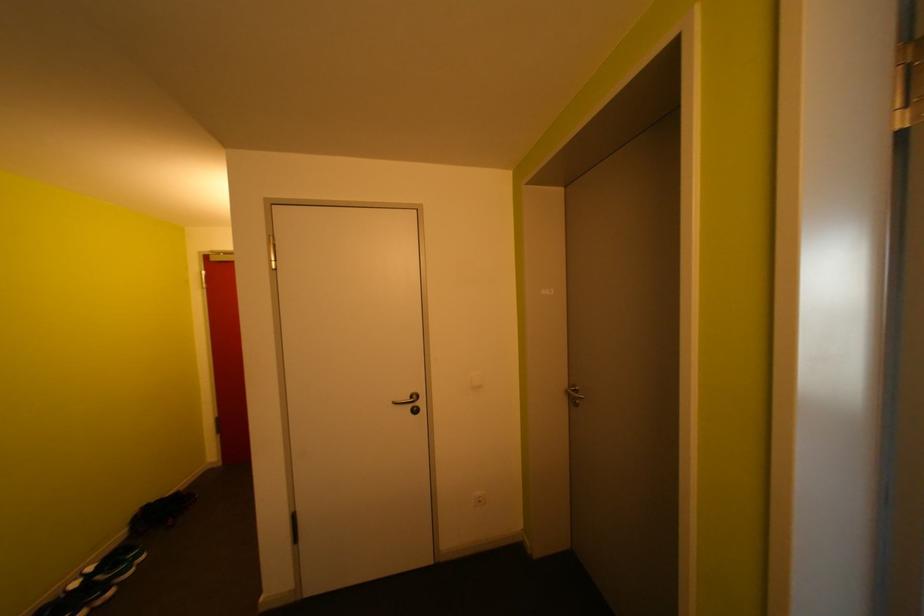
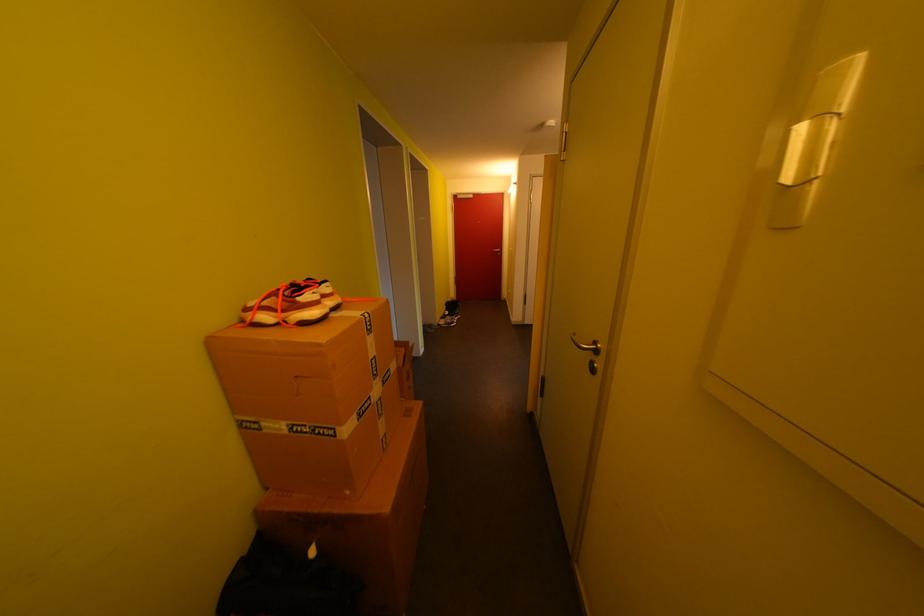
Question: The images are taken continuously from a first-person perspective. In which direction are you moving?

Choices:
 (A) Left
 (B) Right
 (C) Forward
 (D) Backward

Answer: (D)